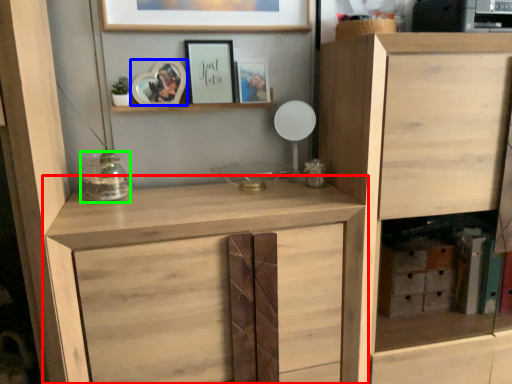
Question: Which object is the farthest from cupboard (highlighted by a red box)? Choose among these: picture frame (highlighted by a blue box) or glass vase (highlighted by a green box).

Choices:
 (A) picture frame
 (B) glass vase

Answer: (A)